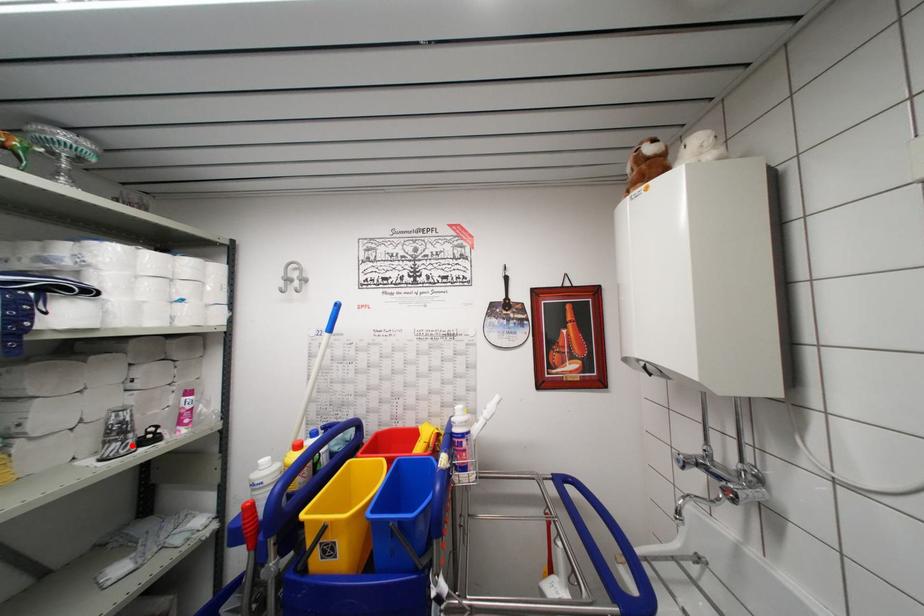
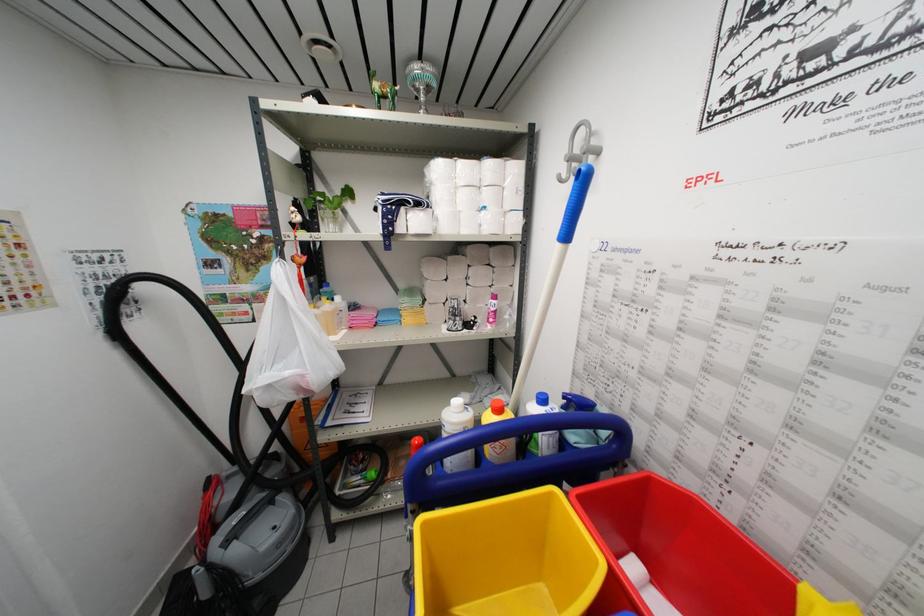
Where in the second image is the point corresponding to the highlighted location from the first image?

(459, 326)